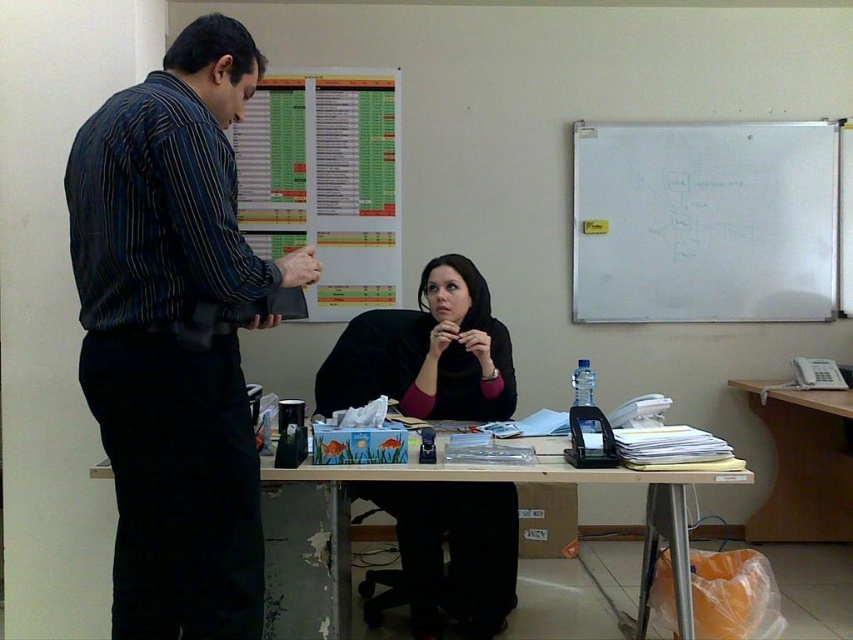
Consider the image. In the office scene, there is a white matte whiteboard at upper right and a point at coordinates (704, 221). Can you tell me if the whiteboard is exactly at that point?

The white matte whiteboard at upper right is located at point (704, 221), so yes, the whiteboard is exactly at that point.

You are an office assistant who needs to hang a large poster that requires 2 meters of vertical space. Based on the scene, which object between the white matte whiteboard at upper right and the wooden table at center would be suitable for hanging the poster?

The white matte whiteboard at upper right is much taller than the wooden table at center, so it would be suitable for hanging the poster that requires 2 meters of vertical space.

You are an interior designer assessing the office layout. The striped fabric shirt at left and the white matte whiteboard at upper right are in view. Which object has a smaller width?

The striped fabric shirt at left has a smaller width than the white matte whiteboard at upper right according to the description.